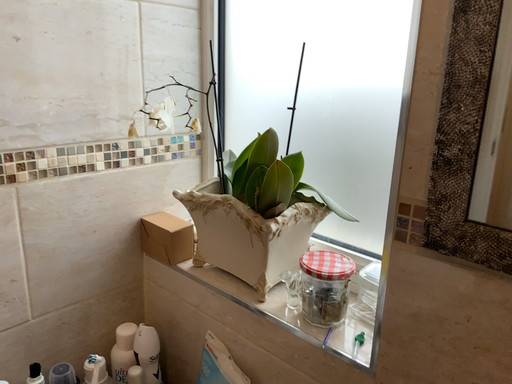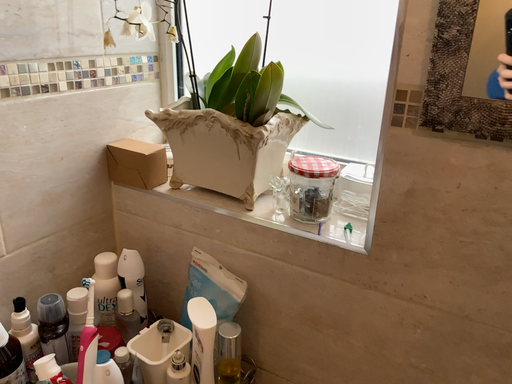
Question: Which way did the camera rotate in the video?

Choices:
 (A) rotated right
 (B) rotated left

Answer: (A)